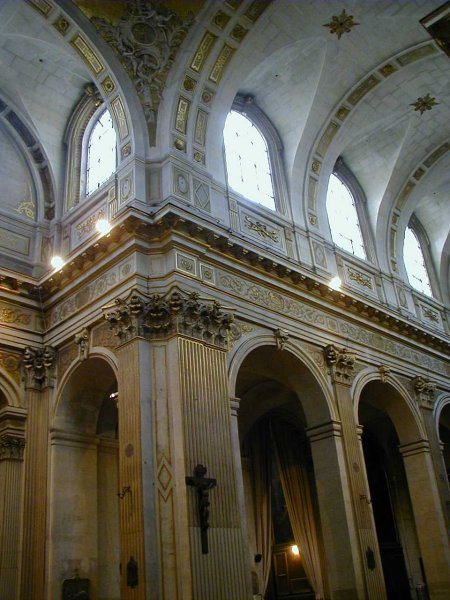
This screenshot has width=450, height=600. Find the location of `pillars`. pillars is located at coordinates (205, 434), (135, 441).